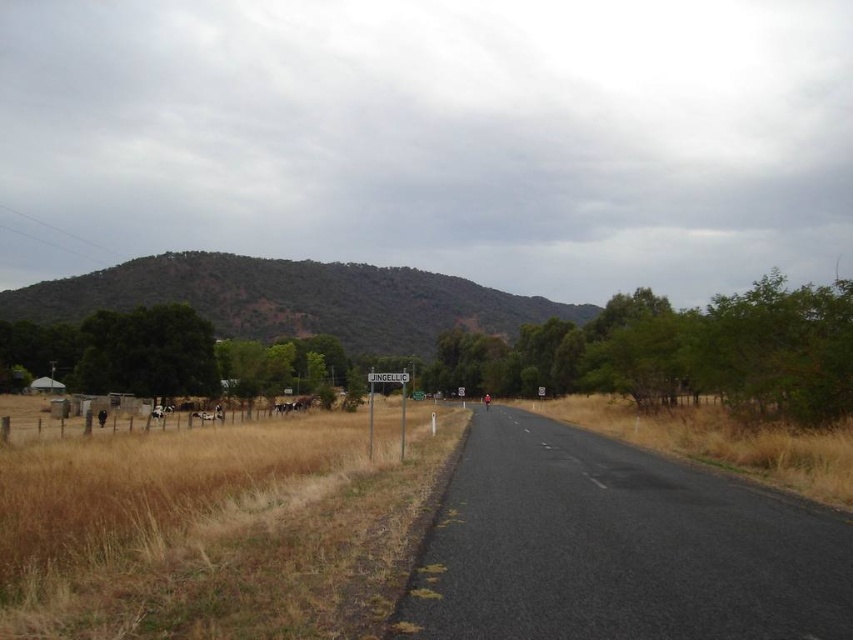
Question: Is dry grass at road center further to camera compared to white woolly sheep at left?

Choices:
 (A) yes
 (B) no

Answer: (B)

Question: Which object is positioned closest to the dry grass at left?

Choices:
 (A) green textured hill at center
 (B) dry grass at road center
 (C) brown fur horse at lower left
 (D) brown fur animal at left

Answer: (B)

Question: Is brown fur horse at lower left bigger than brown fur animal at left?

Choices:
 (A) yes
 (B) no

Answer: (A)

Question: Is dry grass at road center above white woolly sheep at left?

Choices:
 (A) yes
 (B) no

Answer: (A)

Question: Which point appears farthest from the camera in this image?

Choices:
 (A) (154, 515)
 (B) (74, 275)

Answer: (B)

Question: Which of the following is the farthest from the observer?

Choices:
 (A) white woolly sheep at left
 (B) green textured hill at center
 (C) dry grass at left

Answer: (B)